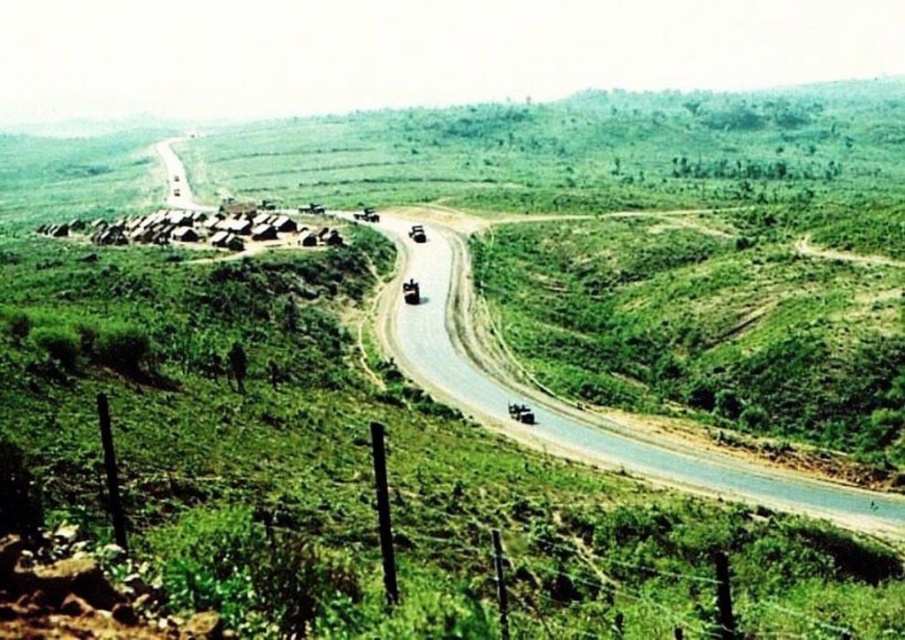
Question: From the image, what is the correct spatial relationship of asphalt road at center in relation to asphalt road at upper left?

Choices:
 (A) right
 (B) left

Answer: (A)

Question: Can you confirm if asphalt road at center is wider than asphalt road at upper left?

Choices:
 (A) yes
 (B) no

Answer: (B)

Question: Is asphalt road at center bigger than asphalt road at upper left?

Choices:
 (A) no
 (B) yes

Answer: (A)

Question: Which object appears closest to the camera in this image?

Choices:
 (A) asphalt road at upper left
 (B) asphalt road at center

Answer: (B)